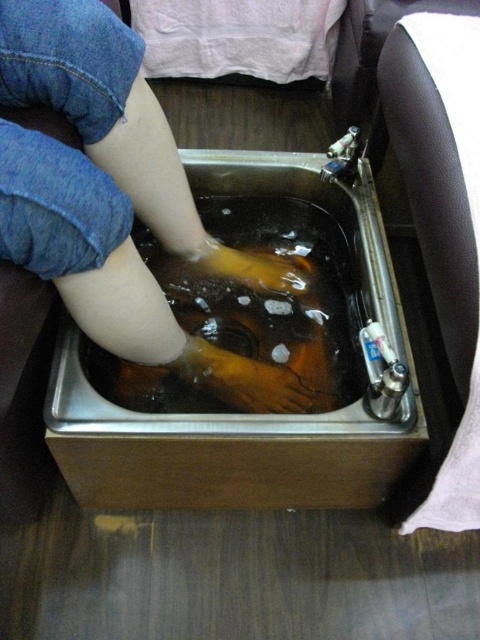
Can you confirm if stainless steel sink at center is taller than smooth skin hand at center?

Indeed, stainless steel sink at center has a greater height compared to smooth skin hand at center.

Between stainless steel sink at center and smooth skin hand at center, which one appears on the left side from the viewer's perspective?

Positioned to the left is smooth skin hand at center.

Where is `stainless steel sink at center`? The height and width of the screenshot is (640, 480). stainless steel sink at center is located at coordinates (249, 413).

Which is below, stainless steel sink at center or yellow rubber glove at center?

stainless steel sink at center is below.

At what (x,y) coordinates should I click in order to perform the action: click on stainless steel sink at center. Please return your answer as a coordinate pair (x, y). Looking at the image, I should click on coord(249,413).

Is smooth skin hand at center smaller than yellow rubber glove at center?

Yes, smooth skin hand at center is smaller than yellow rubber glove at center.

Measure the distance between point [208,376] and camera.

Point [208,376] is 36.96 inches from camera.

The width and height of the screenshot is (480, 640). Identify the location of smooth skin hand at center. (257, 385).